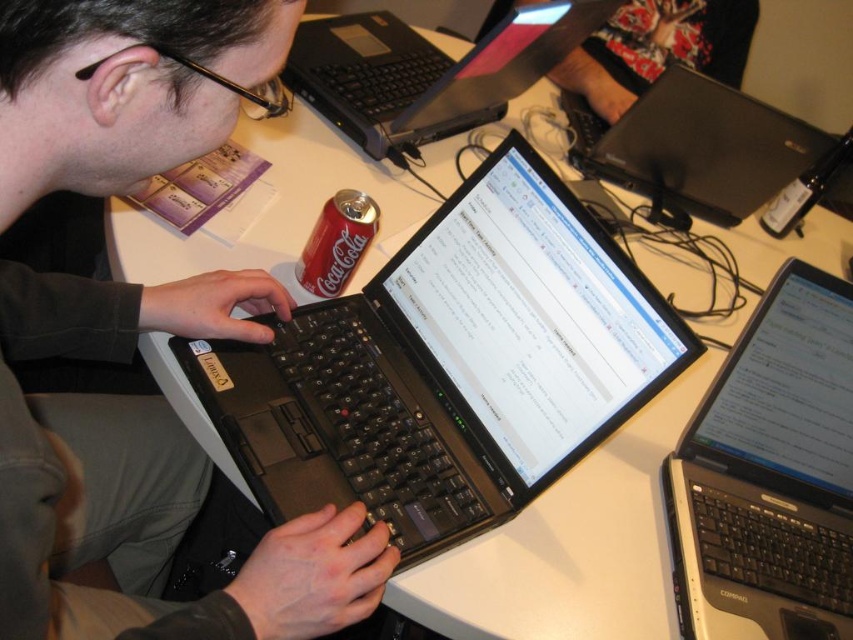
Between point (258, 609) and point (387, 76), which one is positioned in front?

Point (258, 609) is in front.

Is black matte laptop at center below black matte laptop at upper center?

Indeed, black matte laptop at center is positioned under black matte laptop at upper center.

Describe the element at coordinates (144, 480) in the screenshot. This screenshot has width=853, height=640. I see `black matte laptop at center` at that location.

You are a GUI agent. You are given a task and a screenshot of the screen. Output one action in this format:
    pyautogui.click(x=<x>, y=<y>)
    Task: Click on the black matte laptop at center
    Image resolution: width=853 pixels, height=640 pixels.
    Given the screenshot: What is the action you would take?
    pyautogui.click(x=144, y=480)

In the scene shown: Is black matte laptop at center below floral fabric skirt at upper center?

Yes.

Who is shorter, black matte laptop at center or floral fabric skirt at upper center?

floral fabric skirt at upper center

Is point (189, 316) positioned before point (657, 36)?

Yes, point (189, 316) is closer to viewer.

Where is `black matte laptop at center`? This screenshot has width=853, height=640. black matte laptop at center is located at coordinates (144, 480).

Is black plastic laptop at center to the right of floral fabric skirt at upper center from the viewer's perspective?

In fact, black plastic laptop at center is to the left of floral fabric skirt at upper center.

Is point (815, 372) positioned behind point (639, 20)?

No, (815, 372) is closer to viewer.

The height and width of the screenshot is (640, 853). Identify the location of black plastic laptop at center. pyautogui.click(x=770, y=474).